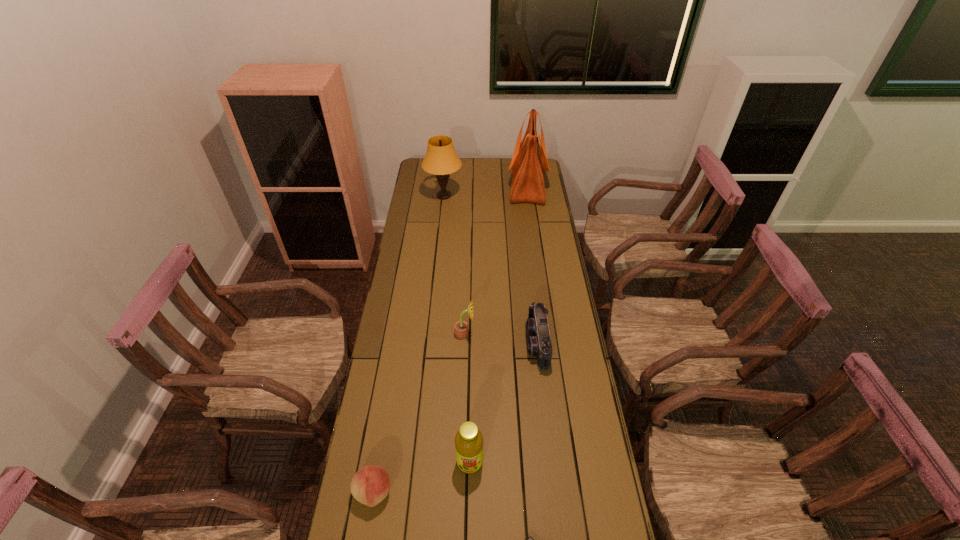
What are the coordinates of `unoccupied position between the shopping bag and the lampshade` in the screenshot? It's located at (486, 191).

Locate an element on the screen. The image size is (960, 540). empty space between the fruit juice and the camcorder is located at coordinates (504, 403).

Find the location of a particular element. This screenshot has width=960, height=540. object that is the fifth closest one to the lampshade is located at coordinates (370, 485).

The height and width of the screenshot is (540, 960). Identify the location of the sixth closest object to the remote control. (441, 159).

Where is `vacant area in the image that satisfies the following two spatial constraints: 1. on the back side of the lampshade; 2. on the left side of the shopping bag`? This screenshot has height=540, width=960. vacant area in the image that satisfies the following two spatial constraints: 1. on the back side of the lampshade; 2. on the left side of the shopping bag is located at coordinates (444, 186).

Where is `free space that satisfies the following two spatial constraints: 1. on the front-facing side of the camcorder; 2. on the front label of the fruit juice`? Image resolution: width=960 pixels, height=540 pixels. free space that satisfies the following two spatial constraints: 1. on the front-facing side of the camcorder; 2. on the front label of the fruit juice is located at coordinates (551, 462).